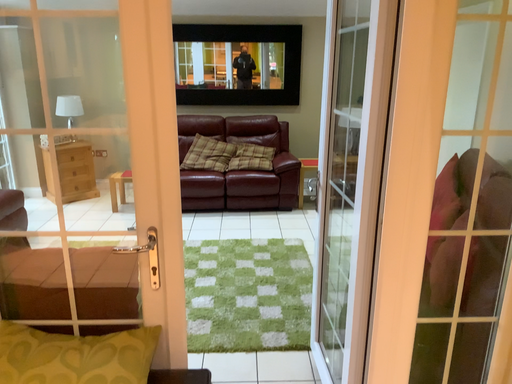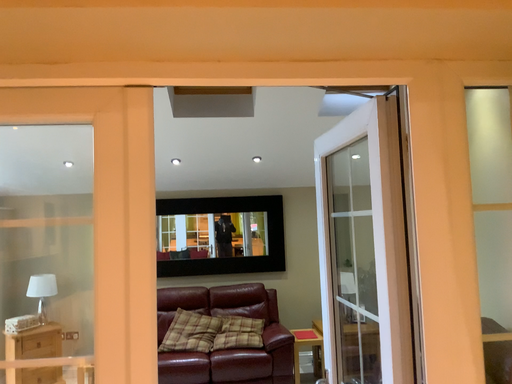
Question: Which way did the camera rotate in the video?

Choices:
 (A) rotated downward
 (B) rotated upward

Answer: (B)